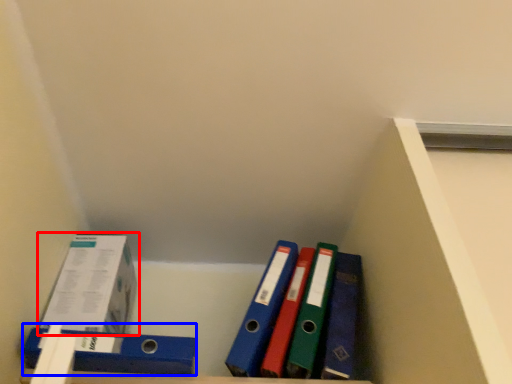
Question: Which object appears farthest to the camera in this image, box (highlighted by a red box) or binder (highlighted by a blue box)?

Choices:
 (A) box
 (B) binder

Answer: (A)